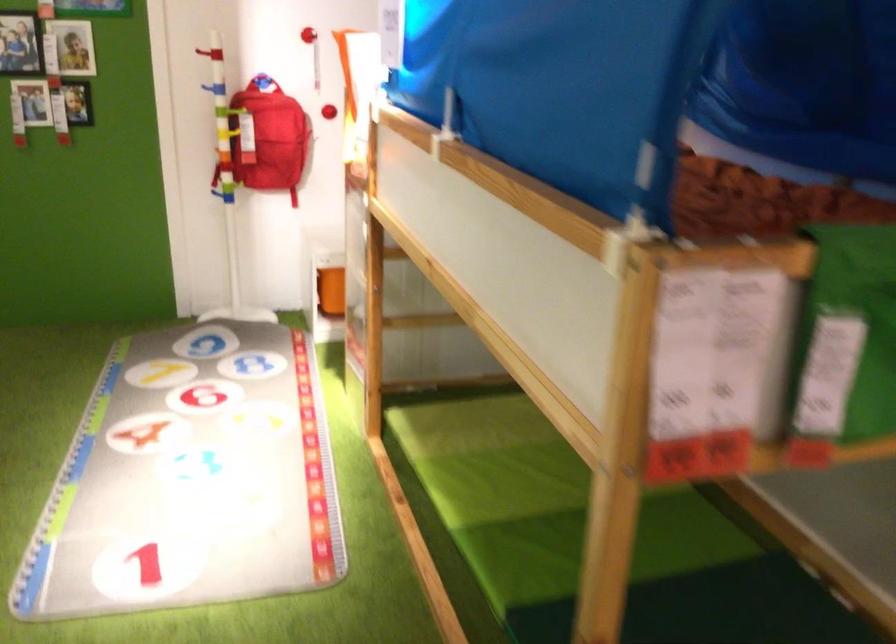
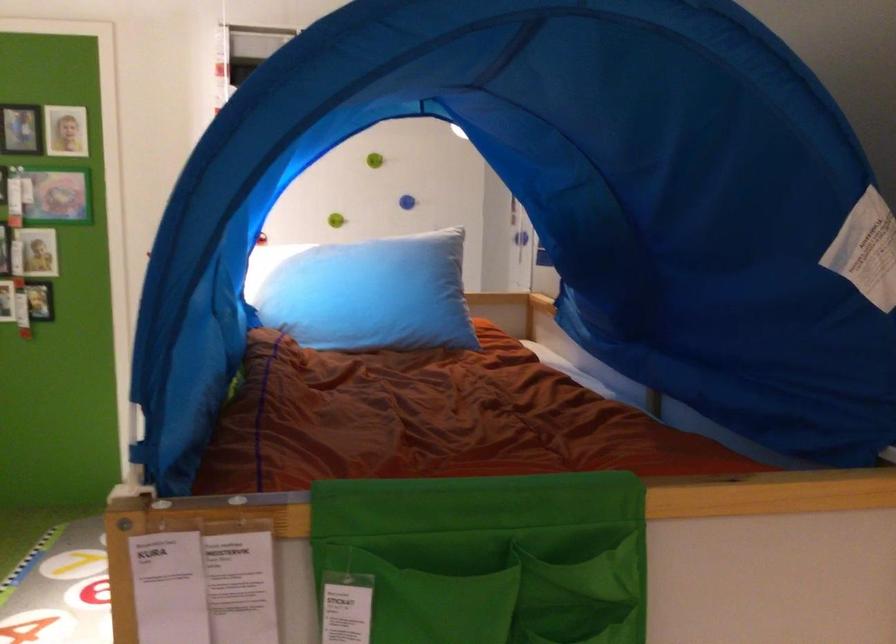
Question: Based on the continuous images, in which direction is the camera rotating? Reply with the corresponding letter.

Choices:
 (A) Left
 (B) Right
 (C) Up
 (D) Down

Answer: (C)